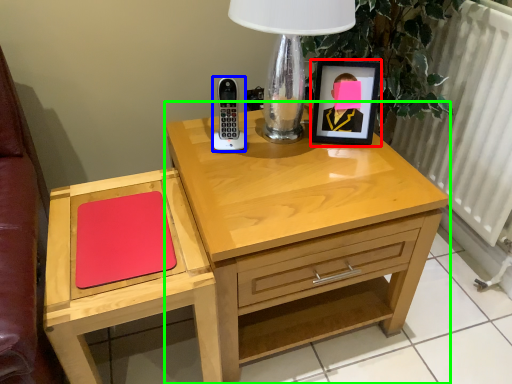
Question: Considering the real-world distances, which object is closest to picture frame (highlighted by a red box)? control (highlighted by a blue box) or nightstand (highlighted by a green box).

Choices:
 (A) control
 (B) nightstand

Answer: (A)